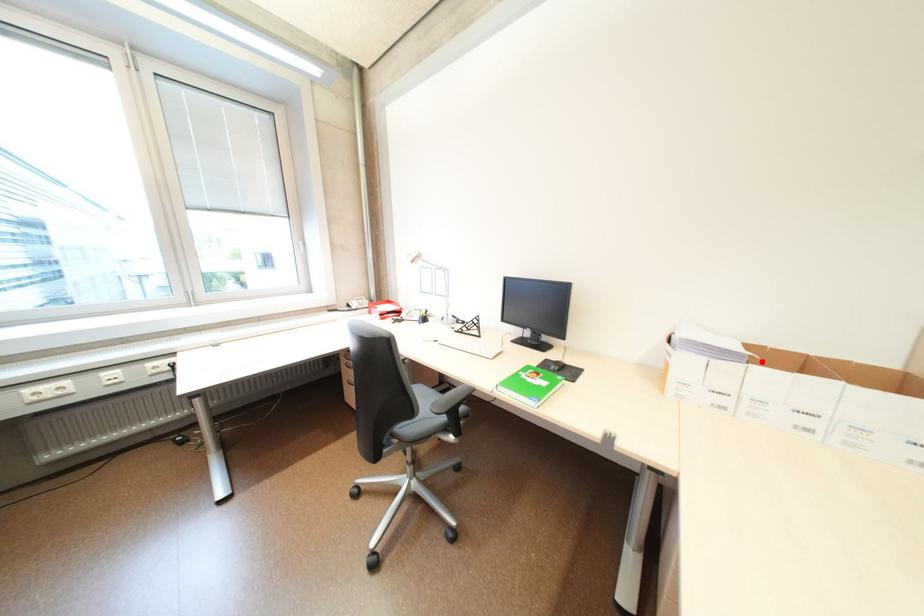
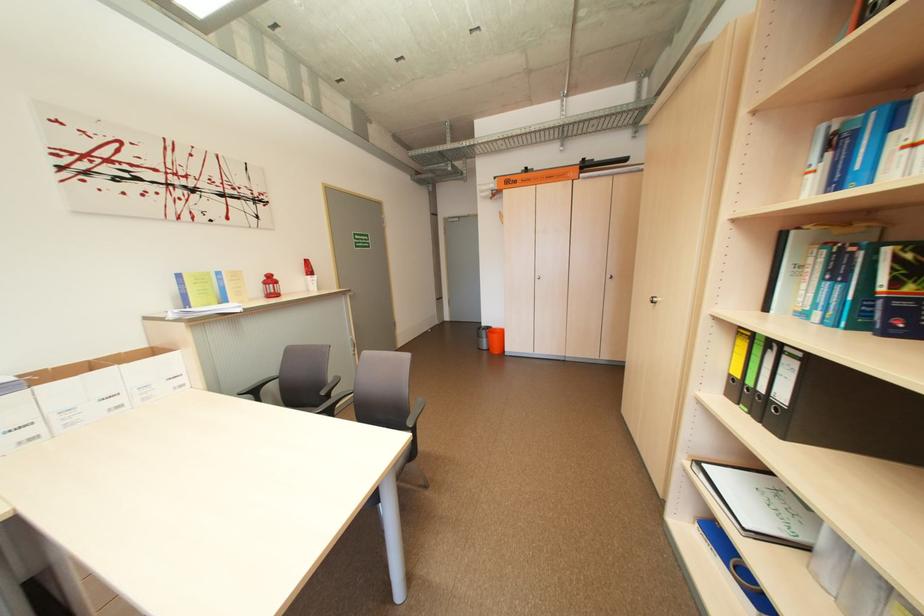
Where in the second image is the point corresponding to the highlighted location from the first image?

(43, 384)